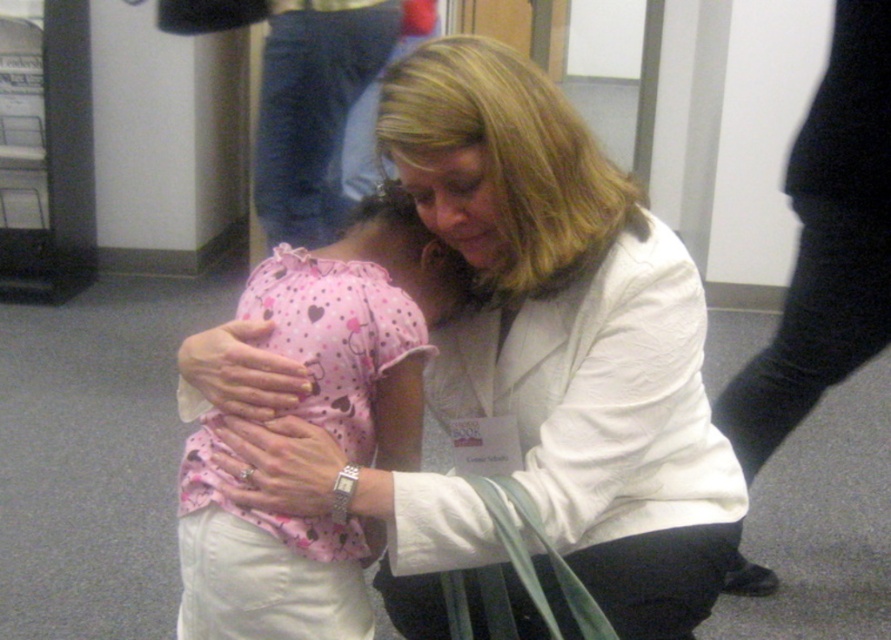
Which is in front, point (522, 637) or point (276, 298)?

Point (276, 298) is more forward.

Is white smooth coat at center to the left of pink dotted fabric at center from the viewer's perspective?

No, white smooth coat at center is not to the left of pink dotted fabric at center.

Is point (534, 307) positioned before point (199, 429)?

Yes, point (534, 307) is closer to viewer.

The image size is (891, 640). In order to click on white smooth coat at center in this screenshot , I will do [568, 333].